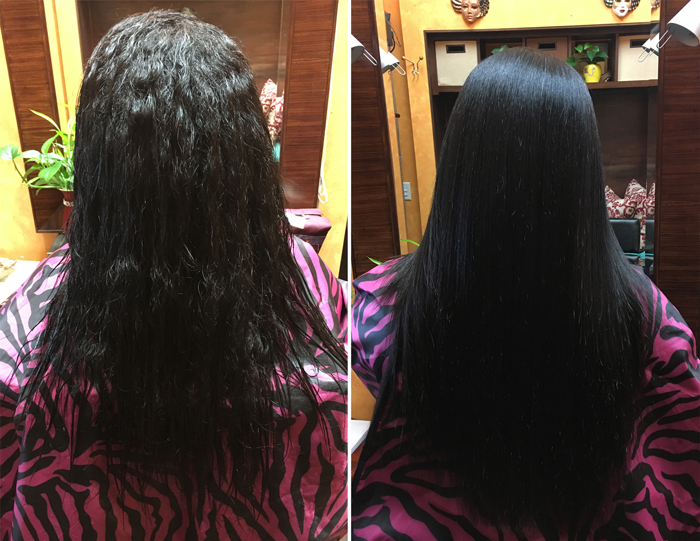
The height and width of the screenshot is (541, 700). I want to click on coat hook, so click(414, 64).